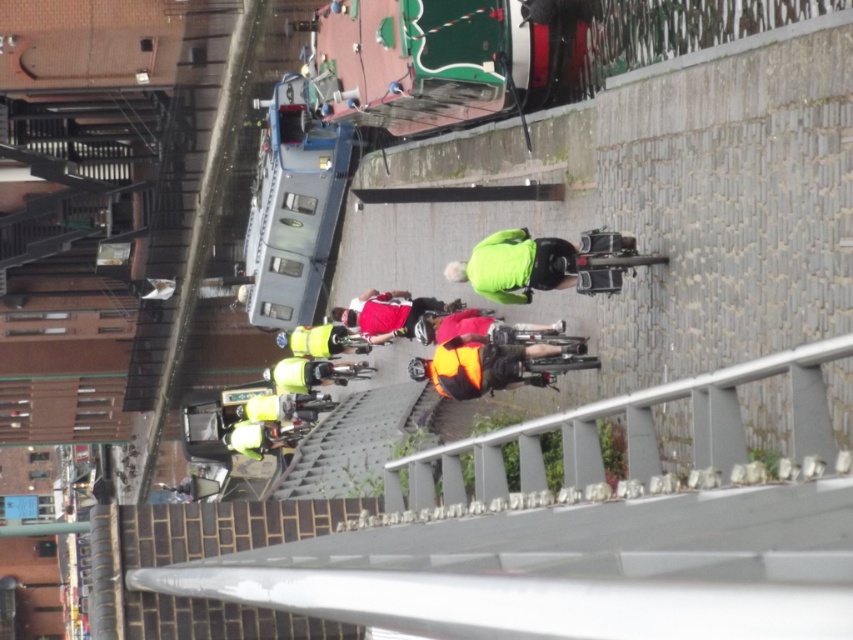
Based on the photo, you are a photographer positioned at the elevated viewpoint. You want to capture a photo where the neon green jacket at center and the reflective red jacket at center are both visible. Which cyclist should you focus on first to ensure both are in frame?

The reflective red jacket at center is to the left of the neon green jacket at center, so focusing on the reflective red jacket at center first will ensure both are captured in the frame.

You are a photographer standing on a bridge overlooking the cyclists. You want to capture a photo that includes both the high visibility orange vest at center and the high visibility yellow jacket at center. Which cyclist should you focus on first to ensure both are in frame?

You should focus on the high visibility yellow jacket at center first because the high visibility orange vest at center is to the right of it, so by centering the yellow jacket, the orange vest will naturally be included to its right within the frame.